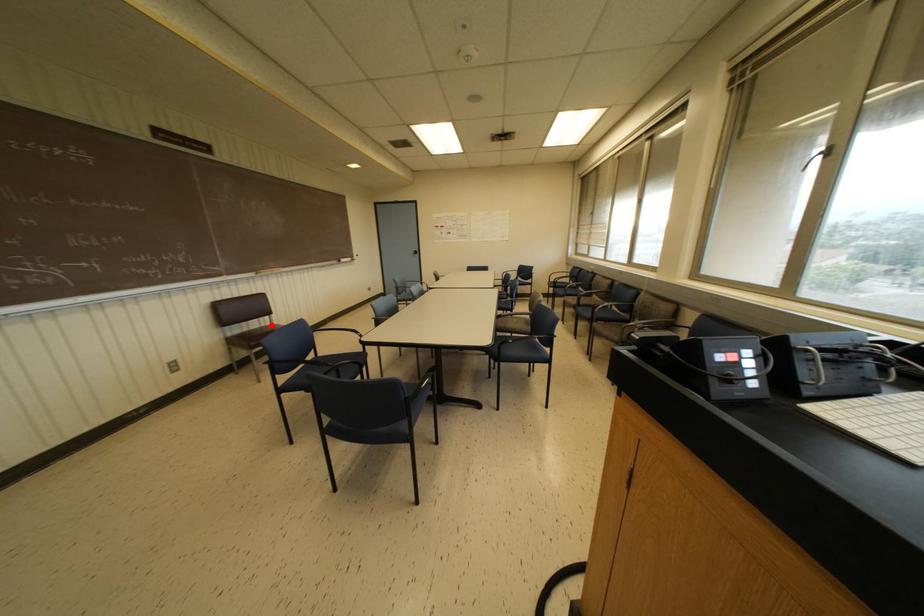
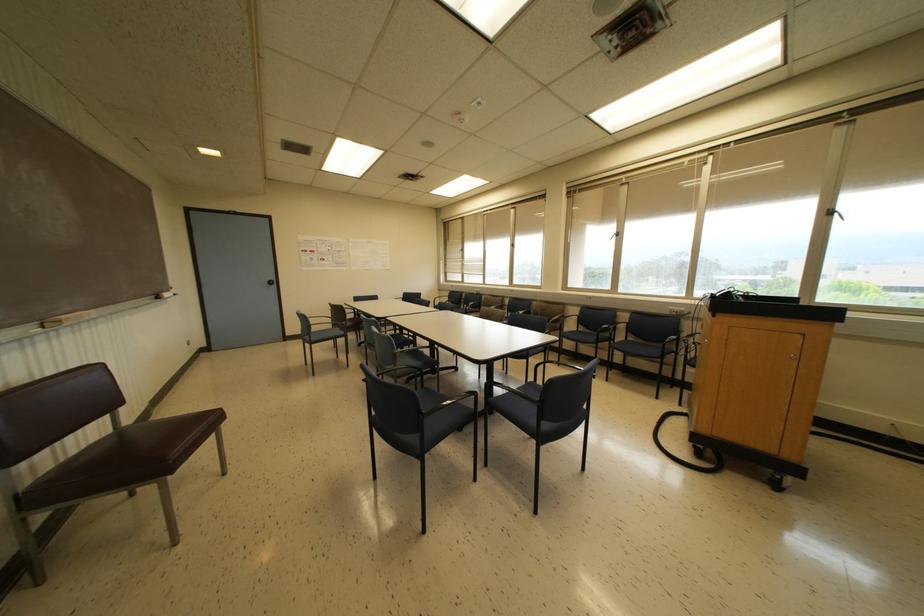
Question: I am providing you with two images of the same scene from different viewpoints. A red point is marked on the first image. Is the red point's position out of view in image 2?

Choices:
 (A) Yes
 (B) No

Answer: (B)